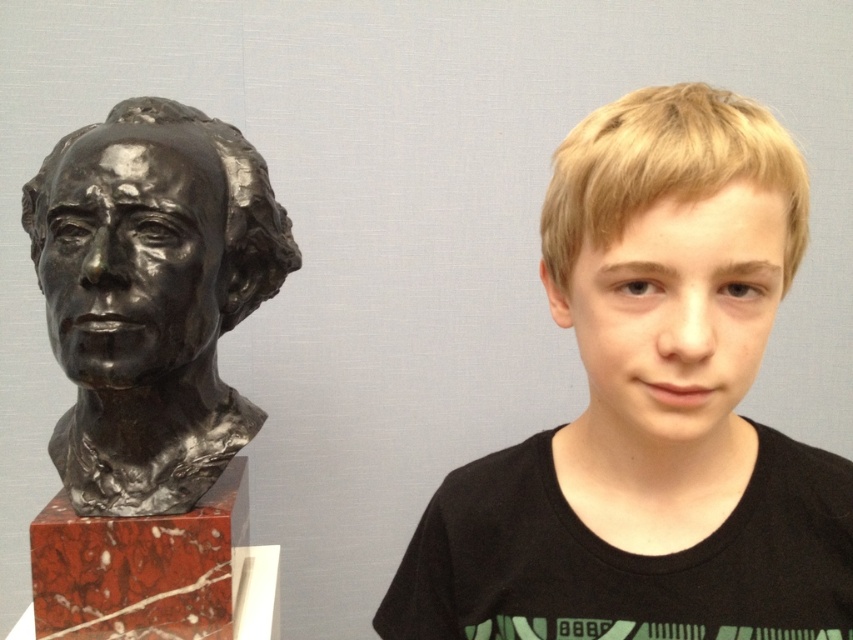
Question: Which of the following is the farthest from the observer?

Choices:
 (A) blonde hair boy at center
 (B) bronze sculpture at left

Answer: (B)

Question: Which object appears closest to the camera in this image?

Choices:
 (A) bronze sculpture at left
 (B) blonde hair boy at center

Answer: (B)

Question: Can you confirm if blonde hair boy at center is wider than bronze sculpture at left?

Choices:
 (A) no
 (B) yes

Answer: (A)

Question: Is blonde hair boy at center below bronze sculpture at left?

Choices:
 (A) no
 (B) yes

Answer: (B)

Question: Can you confirm if blonde hair boy at center is positioned to the right of bronze sculpture at left?

Choices:
 (A) no
 (B) yes

Answer: (B)